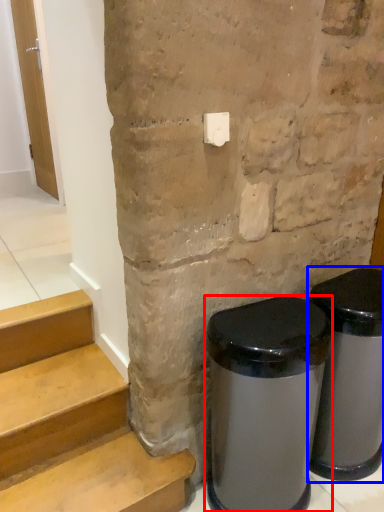
Question: Which object is closer to the camera taking this photo, waste container (highlighted by a red box) or waste container (highlighted by a blue box)?

Choices:
 (A) waste container
 (B) waste container

Answer: (A)